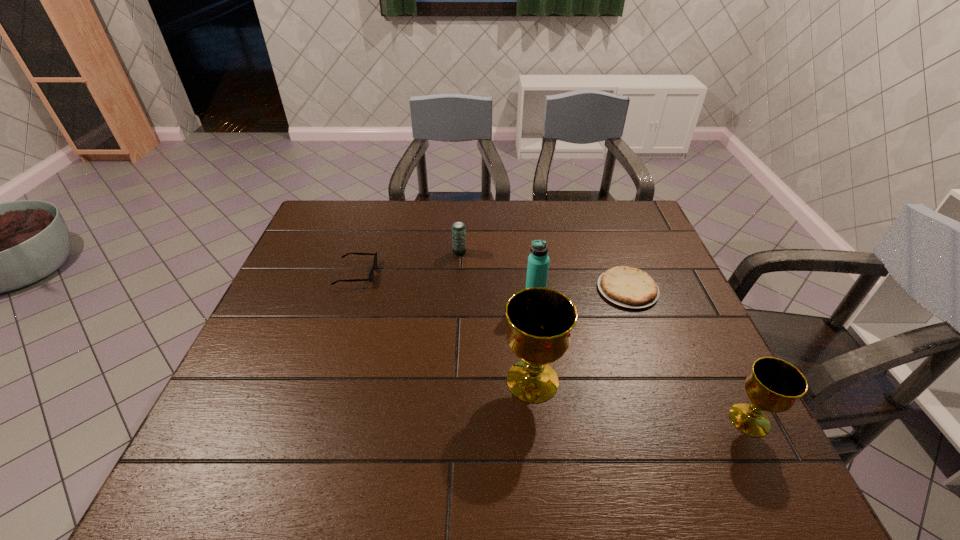
In order to click on vacant space that satisfies the following two spatial constraints: 1. on the front side of the tortilla; 2. on the left side of the fifth object from right to left in this screenshot , I will do `click(457, 289)`.

Locate an element on the screen. The width and height of the screenshot is (960, 540). vacant space that satisfies the following two spatial constraints: 1. on the front-facing side of the leftmost object; 2. on the back side of the tortilla is located at coordinates (350, 289).

Identify the location of free point that satisfies the following two spatial constraints: 1. on the front-facing side of the tortilla; 2. on the left side of the fifth tallest object. Image resolution: width=960 pixels, height=540 pixels. (350, 289).